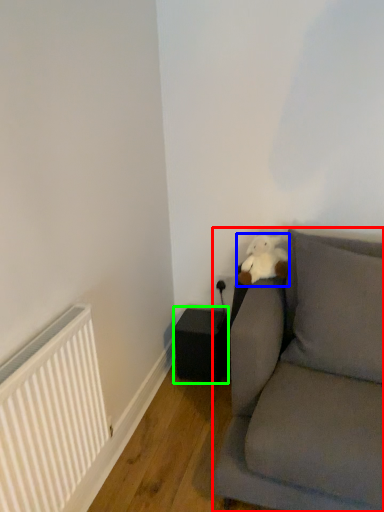
Question: Which object is positioned farthest from studio couch (highlighted by a red box)? Select from teddy (highlighted by a blue box) and speaker (highlighted by a green box).

Choices:
 (A) teddy
 (B) speaker

Answer: (B)